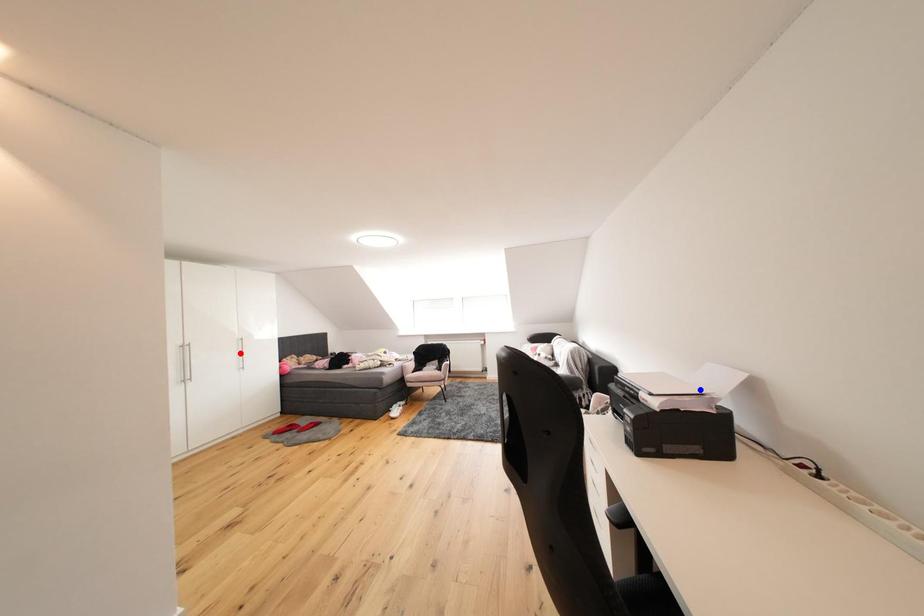
Question: Two points are marked on the image. Which point is closer to the camera?

Choices:
 (A) Blue point is closer.
 (B) Red point is closer.

Answer: (A)